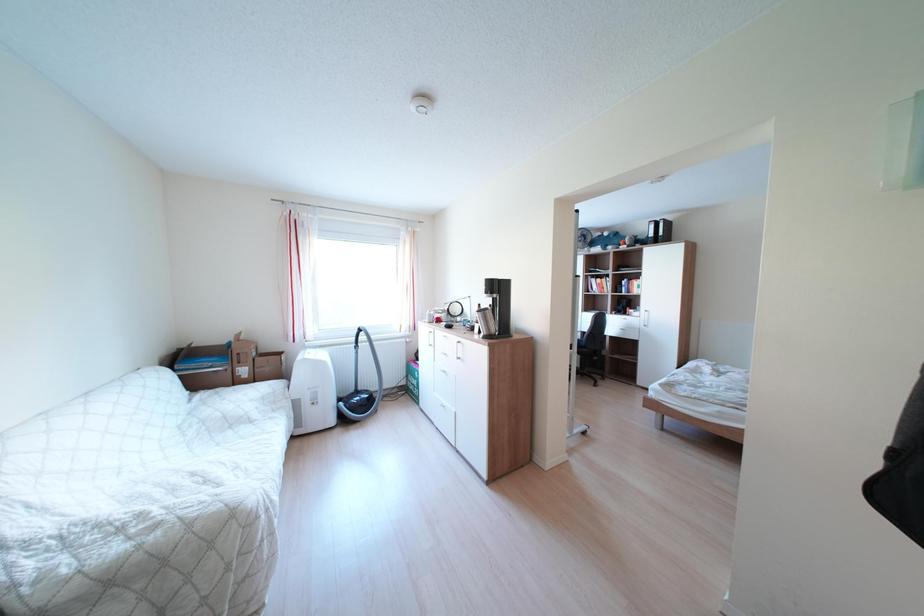
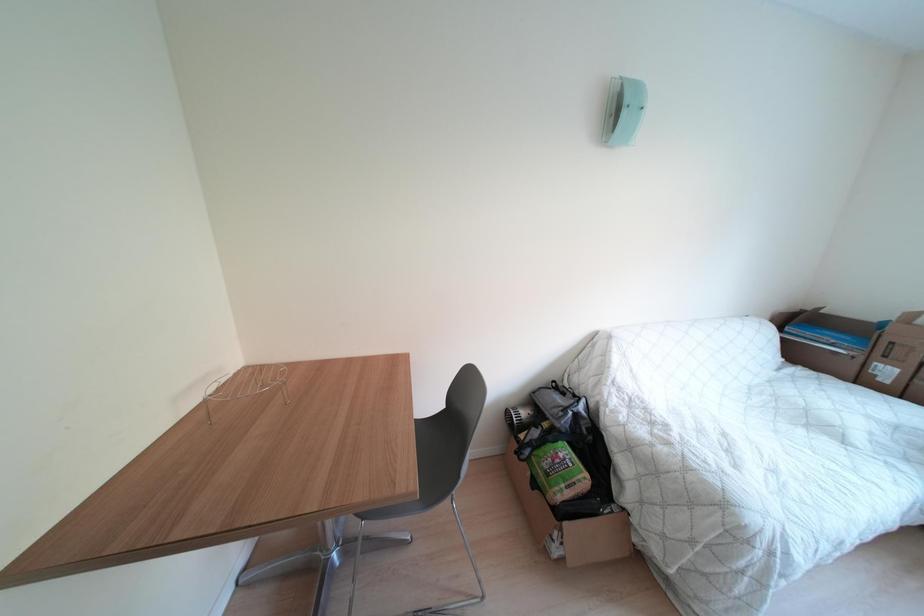
First-person continuous shooting, in which direction is the camera rotating?

The rotation direction of the camera is left-down.